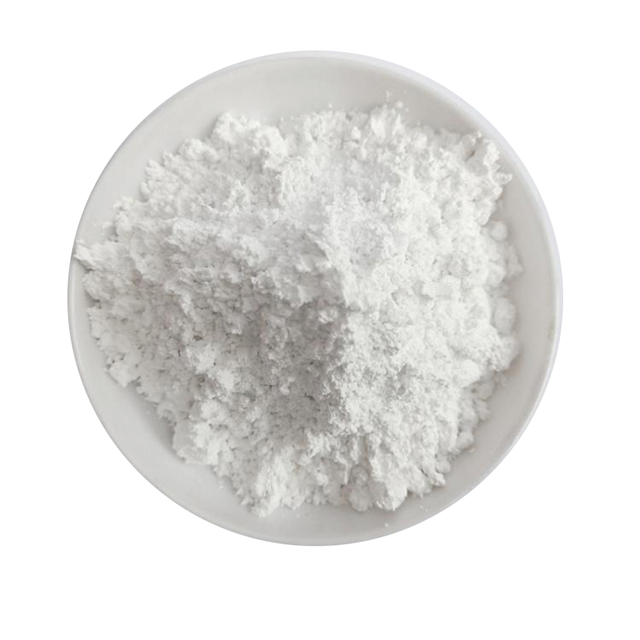
This screenshot has width=640, height=640. I want to click on inside right side of bowl, so [527, 324], [518, 383].